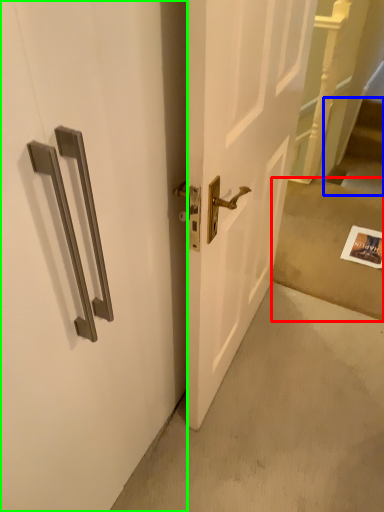
Question: Estimate the real-world distances between objects in this image. Which object is closer to concrete (highlighted by a red box), stairwell (highlighted by a blue box) or door (highlighted by a green box)?

Choices:
 (A) stairwell
 (B) door

Answer: (A)